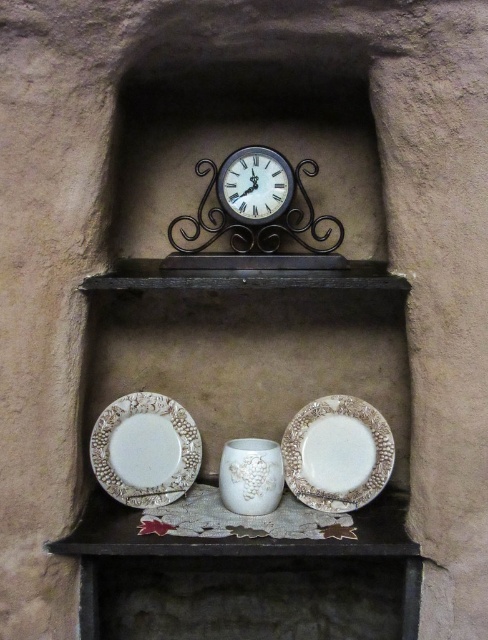
Question: Does white ceramic platter at lower left appear under metallic clock at center?

Choices:
 (A) yes
 (B) no

Answer: (A)

Question: Is white ceramic platter at lower left wider than metallic clock at center?

Choices:
 (A) no
 (B) yes

Answer: (B)

Question: From the image, what is the correct spatial relationship of white ceramic platter at lower left in relation to white textured platter at lower center?

Choices:
 (A) above
 (B) below

Answer: (A)

Question: Estimate the real-world distances between objects in this image. Which object is closer to the white ceramic platter at lower left?

Choices:
 (A) metallic clock at center
 (B) white textured platter at lower center

Answer: (B)

Question: Estimate the real-world distances between objects in this image. Which object is farther from the metallic clock at center?

Choices:
 (A) white ceramic platter at lower left
 (B) white textured platter at lower center

Answer: (A)

Question: Which point is closer to the camera?

Choices:
 (A) (133, 435)
 (B) (256, 221)

Answer: (B)